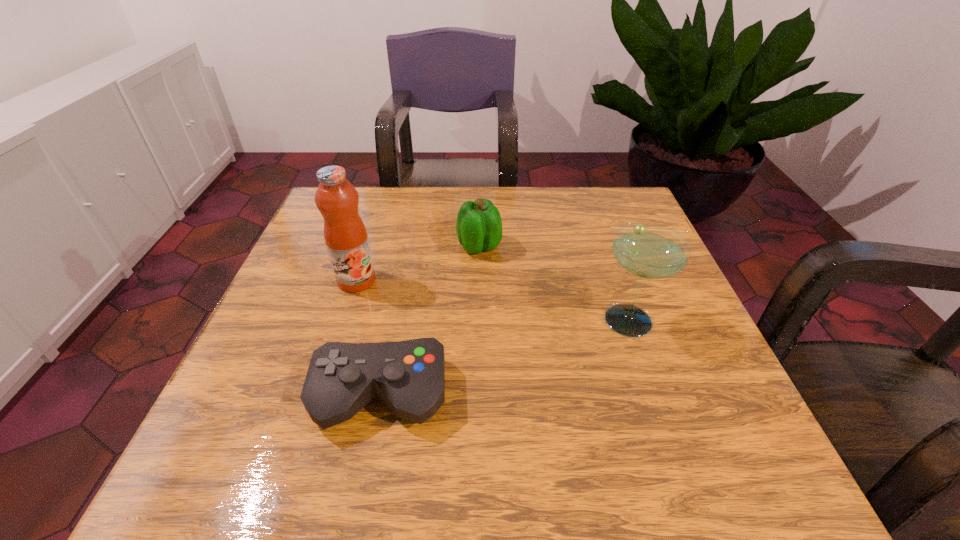
The width and height of the screenshot is (960, 540). I want to click on the tallest object, so click(345, 234).

Find the location of `fruit juice`. fruit juice is located at coordinates click(x=345, y=234).

Locate an element on the screen. the rightmost object is located at coordinates (648, 250).

Identify the location of the third farthest object. (648, 250).

In order to click on the farthest object in this screenshot , I will do `click(479, 226)`.

At what (x,y) coordinates should I click in order to perform the action: click on bell pepper. Please return your answer as a coordinate pair (x, y). This screenshot has width=960, height=540. Looking at the image, I should click on (479, 226).

Locate an element on the screen. the shortest object is located at coordinates (408, 376).

Find the location of a particular element. This screenshot has width=960, height=540. the nearest object is located at coordinates (408, 376).

Locate an element on the screen. Image resolution: width=960 pixels, height=540 pixels. blank space located 0.150m on the front label of the fruit juice is located at coordinates (334, 350).

Find the location of a particular element. free region located 0.320m on the back of the third farthest object is located at coordinates (594, 212).